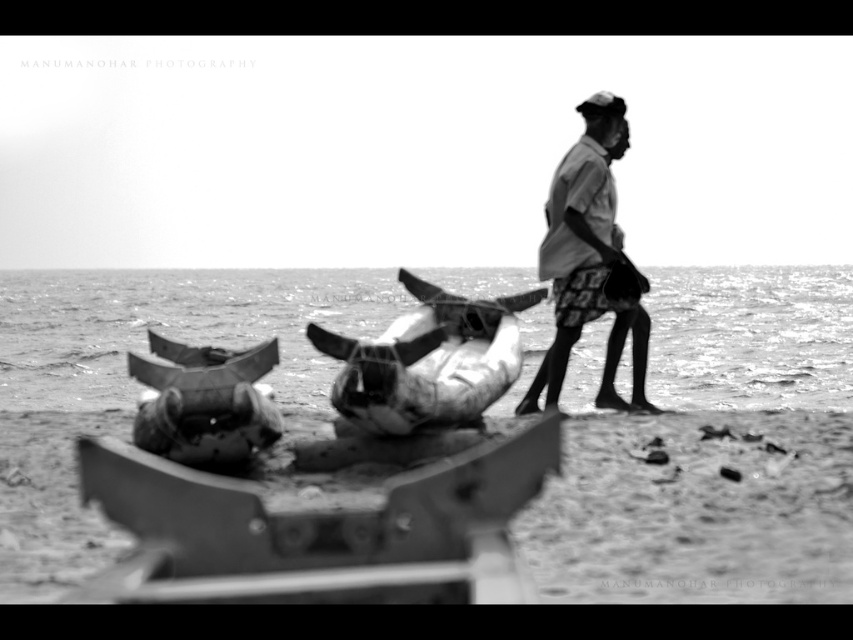
Question: Is rusty metal boat at center smaller than light gray fabric shirt at right?

Choices:
 (A) yes
 (B) no

Answer: (B)

Question: Which point is farther to the camera?

Choices:
 (A) light gray fabric shirt at right
 (B) rusty metal boat at center

Answer: (A)

Question: Observing the image, what is the correct spatial positioning of rusty metal boat at center in reference to light gray fabric shirt at right?

Choices:
 (A) below
 (B) above

Answer: (A)

Question: Does rusty metal boat at center appear on the right side of light gray fabric shirt at right?

Choices:
 (A) no
 (B) yes

Answer: (A)

Question: Which of the following is the farthest from the observer?

Choices:
 (A) rusty metal boat at center
 (B) light gray fabric shirt at right

Answer: (B)

Question: Which object appears closest to the camera in this image?

Choices:
 (A) light gray fabric shirt at right
 (B) rusty metal boat at center

Answer: (B)